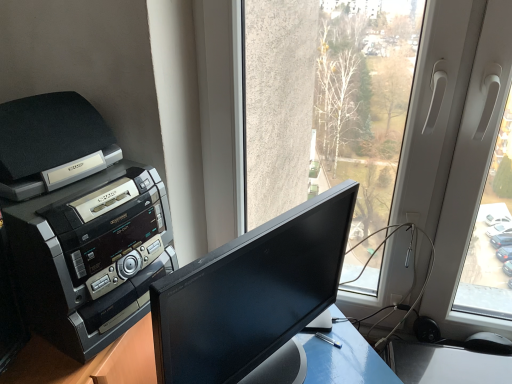
Question: From a real-world perspective, is black plastic printer at left located beneath black glossy monitor at center?

Choices:
 (A) yes
 (B) no

Answer: (B)

Question: Is black plastic printer at left far away from black glossy monitor at center?

Choices:
 (A) yes
 (B) no

Answer: (B)

Question: From the image's perspective, is black plastic printer at left under black glossy monitor at center?

Choices:
 (A) yes
 (B) no

Answer: (B)

Question: Is black plastic printer at left at the right side of black glossy monitor at center?

Choices:
 (A) no
 (B) yes

Answer: (A)

Question: Could you tell me if black plastic printer at left is facing black glossy monitor at center?

Choices:
 (A) no
 (B) yes

Answer: (B)

Question: Can you confirm if black plastic printer at left is positioned to the left of black glossy monitor at center?

Choices:
 (A) no
 (B) yes

Answer: (B)

Question: Is black glossy monitor at center wider than black plastic mouse at lower right?

Choices:
 (A) no
 (B) yes

Answer: (B)

Question: Can you confirm if black glossy monitor at center is thinner than black plastic mouse at lower right?

Choices:
 (A) yes
 (B) no

Answer: (B)

Question: Is black glossy monitor at center not within black plastic mouse at lower right?

Choices:
 (A) no
 (B) yes

Answer: (B)

Question: From the image's perspective, would you say black glossy monitor at center is positioned over black plastic mouse at lower right?

Choices:
 (A) no
 (B) yes

Answer: (B)

Question: Considering the relative positions of black glossy monitor at center and black plastic mouse at lower right in the image provided, is black glossy monitor at center in front of black plastic mouse at lower right?

Choices:
 (A) yes
 (B) no

Answer: (A)

Question: Is black glossy monitor at center further to the viewer compared to black plastic mouse at lower right?

Choices:
 (A) no
 (B) yes

Answer: (A)

Question: Is black glossy monitor at center turned away from black plastic printer at left?

Choices:
 (A) yes
 (B) no

Answer: (A)